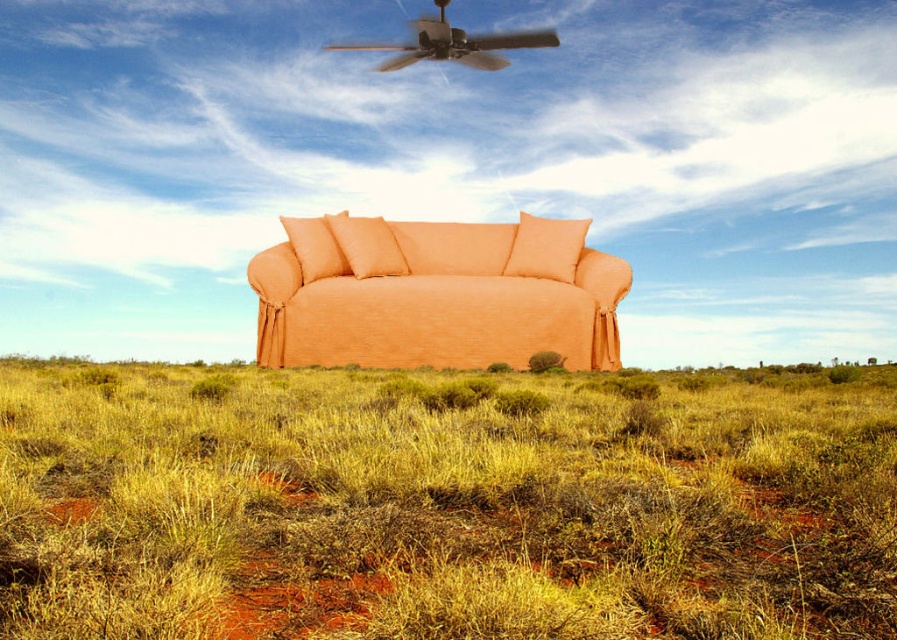
This screenshot has height=640, width=897. What do you see at coordinates (443, 502) in the screenshot? I see `yellow dry grass at lower center` at bounding box center [443, 502].

Which is behind, point (497, 520) or point (325, 342)?

Point (325, 342)

Identify the location of yellow dry grass at lower center. (443, 502).

Can you confirm if yellow dry grass at lower center is positioned below orange fabric pillow at center?

Correct, yellow dry grass at lower center is located below orange fabric pillow at center.

Is yellow dry grass at lower center taller than orange fabric pillow at center?

Incorrect, yellow dry grass at lower center's height is not larger of orange fabric pillow at center's.

Does point (412, 612) come closer to viewer compared to point (538, 252)?

Yes, it is.

This screenshot has width=897, height=640. What are the coordinates of `yellow dry grass at lower center` in the screenshot? It's located at (443, 502).

Is orange fabric couch at center below orange fabric pillow at center?

Yes.

Is point (612, 276) closer to viewer compared to point (556, 220)?

Yes, point (612, 276) is in front of point (556, 220).

Between point (589, 342) and point (511, 269), which one is positioned in front?

Point (589, 342) is more forward.

At what (x,y) coordinates should I click in order to perform the action: click on orange fabric couch at center. Please return your answer as a coordinate pair (x, y). Image resolution: width=897 pixels, height=640 pixels. Looking at the image, I should click on (434, 296).